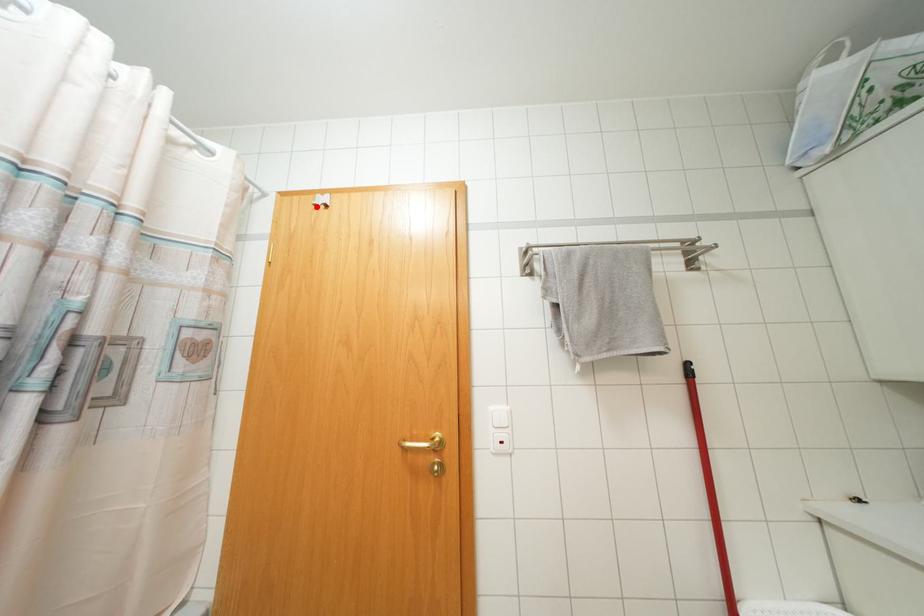
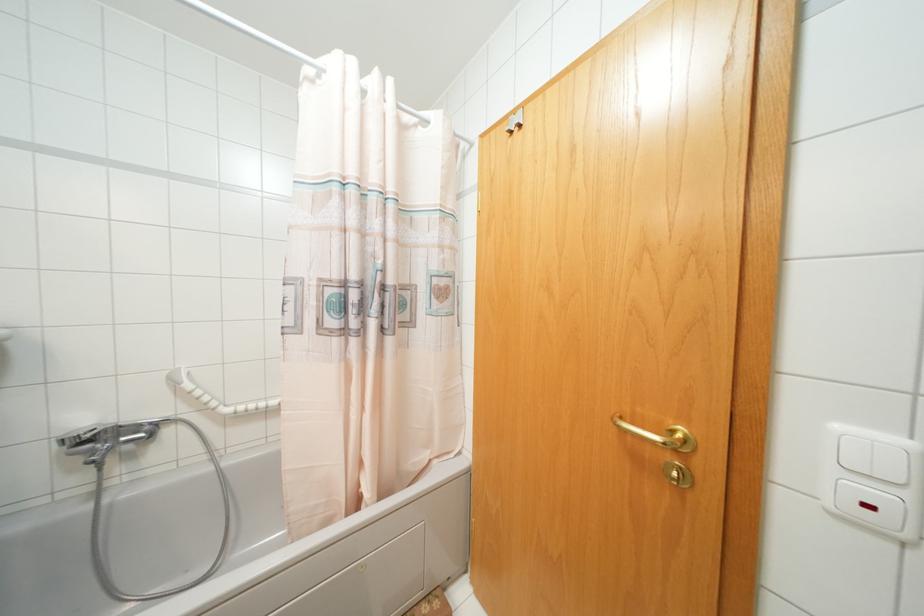
Find the pixel in the second image that matches the highlighted location in the first image.

(511, 132)